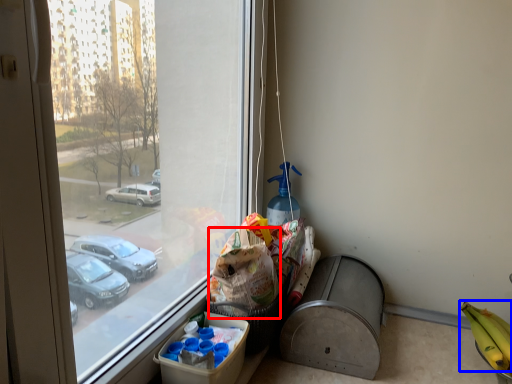
Question: Among these objects, which one is farthest to the camera, grocery bag (highlighted by a red box) or banana (highlighted by a blue box)?

Choices:
 (A) grocery bag
 (B) banana

Answer: (A)